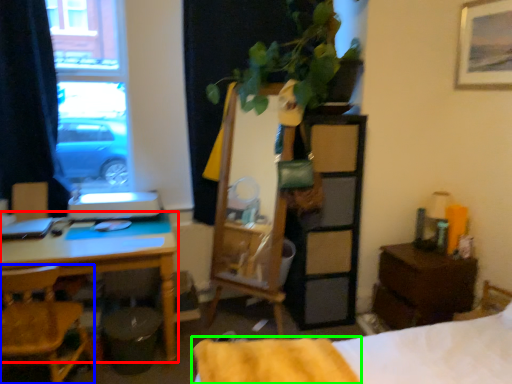
Question: Which object is positioned closest to desk (highlighted by a red box)? Select from chair (highlighted by a blue box) and blanket (highlighted by a green box).

Choices:
 (A) chair
 (B) blanket

Answer: (A)